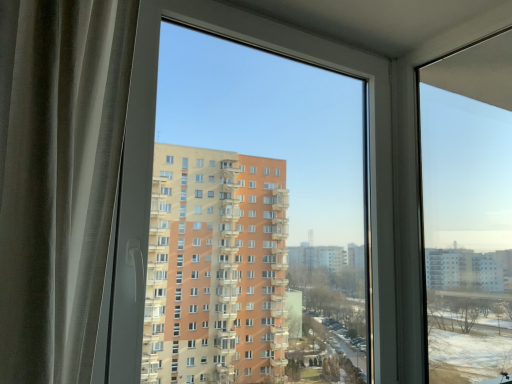
Question: Is transparent glass window at right in front of or behind transparent plastic window at center in the image?

Choices:
 (A) behind
 (B) front

Answer: (A)

Question: Is point (429, 372) closer or farther from the camera than point (303, 286)?

Choices:
 (A) closer
 (B) farther

Answer: (A)

Question: Is transparent glass window at right bigger or smaller than transparent plastic window at center?

Choices:
 (A) small
 (B) big

Answer: (A)

Question: Do you think transparent plastic window at center is within transparent glass window at right, or outside of it?

Choices:
 (A) outside
 (B) inside

Answer: (A)

Question: Considering the relative positions of transparent plastic window at center and transparent glass window at right in the image provided, is transparent plastic window at center to the left or to the right of transparent glass window at right?

Choices:
 (A) left
 (B) right

Answer: (A)

Question: From their relative heights in the image, would you say transparent plastic window at center is taller or shorter than transparent glass window at right?

Choices:
 (A) tall
 (B) short

Answer: (A)

Question: Looking at their shapes, would you say transparent plastic window at center is wider or thinner than transparent glass window at right?

Choices:
 (A) wide
 (B) thin

Answer: (B)